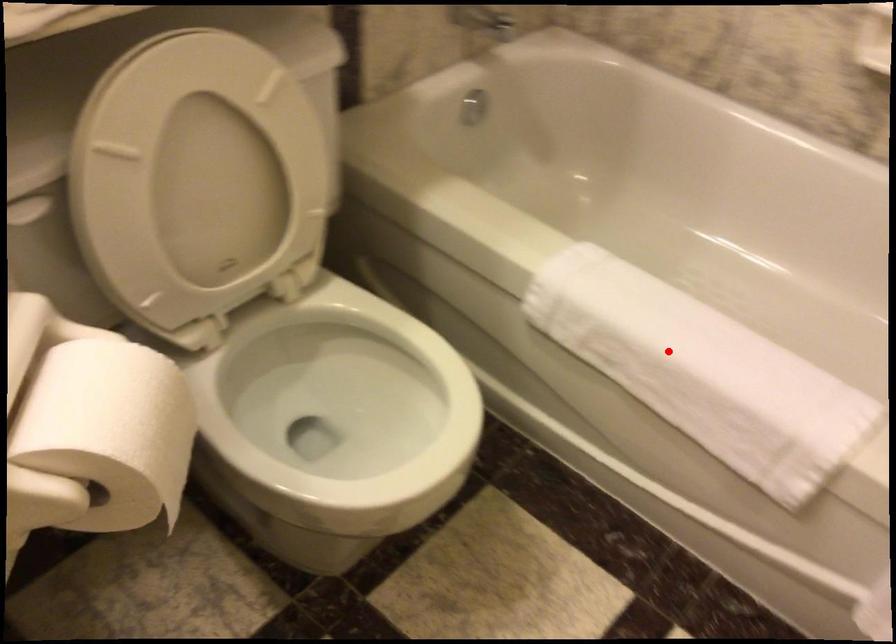
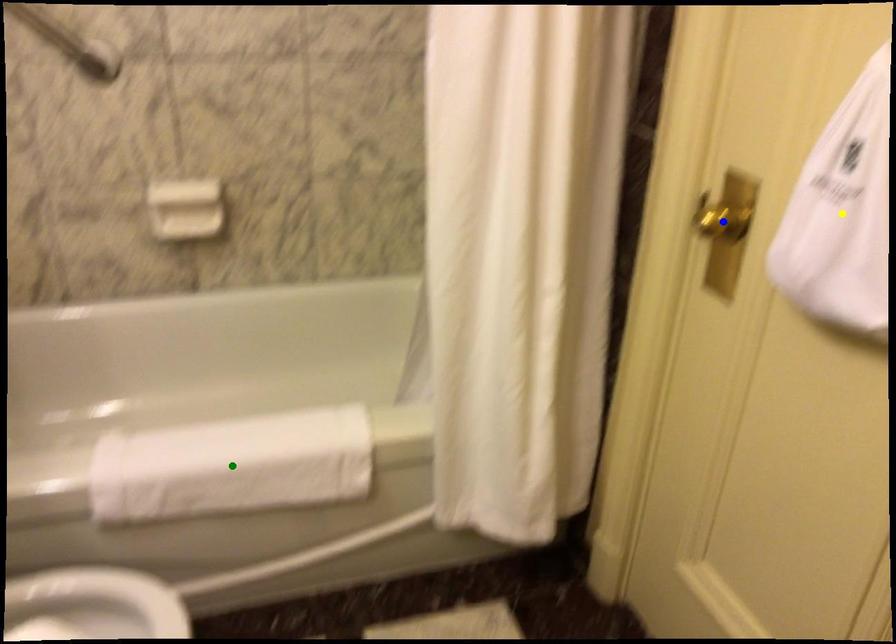
Question: I am providing you with two images of the same scene from different viewpoints. A red point is marked on the first image. You are given multiple points on the second image. Which mark in image 2 goes with the point in image 1?

Choices:
 (A) blue point
 (B) yellow point
 (C) green point

Answer: (C)